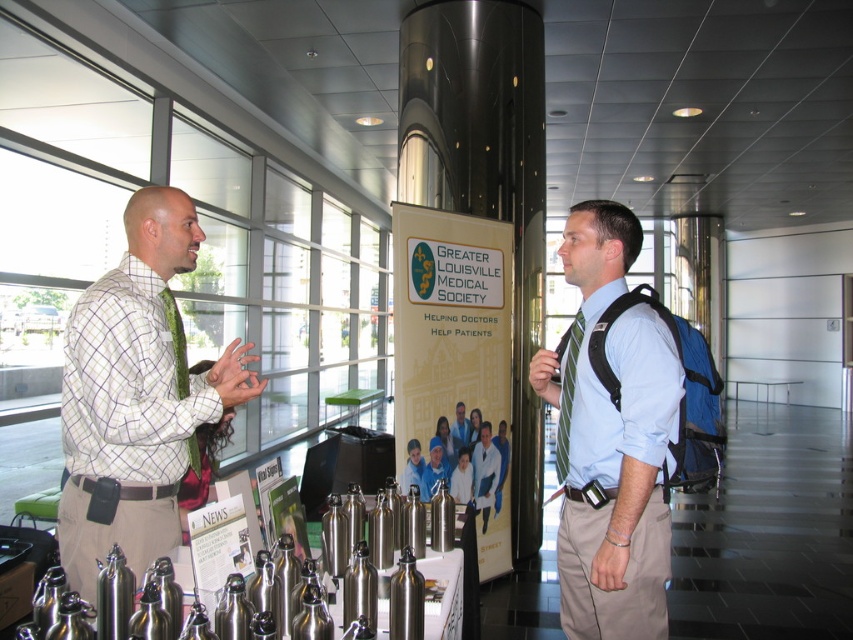
Can you confirm if yellow paper poster at center is smaller than light blue shirt at center?

No.

Does point (506, 396) lie behind point (467, 445)?

Yes, point (506, 396) is behind point (467, 445).

Consider the image. Measure the distance between point (469, 388) and camera.

They are 12.83 feet apart.

At what (x,y) coordinates should I click in order to perform the action: click on yellow paper poster at center. Please return your answer as a coordinate pair (x, y). Image resolution: width=853 pixels, height=640 pixels. Looking at the image, I should click on (448, 321).

Is light blue shirt with tie at right taller than yellow paper poster at center?

In fact, light blue shirt with tie at right may be shorter than yellow paper poster at center.

Locate an element on the screen. This screenshot has height=640, width=853. light blue shirt with tie at right is located at coordinates (610, 438).

The image size is (853, 640). What are the coordinates of `light blue shirt with tie at right` in the screenshot? It's located at (610, 438).

The image size is (853, 640). What are the coordinates of `plaid shirt at left` in the screenshot? It's located at (136, 396).

Can you confirm if plaid shirt at left is positioned to the right of yellow paper poster at center?

In fact, plaid shirt at left is to the left of yellow paper poster at center.

This screenshot has width=853, height=640. Find the location of `plaid shirt at left`. plaid shirt at left is located at coordinates (136, 396).

At what (x,y) coordinates should I click in order to perform the action: click on plaid shirt at left. Please return your answer as a coordinate pair (x, y). Looking at the image, I should click on (136, 396).